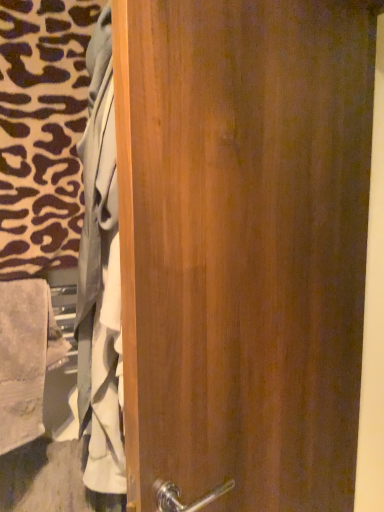
What is the approximate width of wooden door at center?

It is 14.48 centimeters.

This screenshot has width=384, height=512. Describe the element at coordinates (244, 245) in the screenshot. I see `wooden door at center` at that location.

Measure the distance between wooden door at center and camera.

A distance of 24.18 inches exists between wooden door at center and camera.

Find the location of a particular element. This screenshot has height=512, width=384. wooden door at center is located at coordinates 244,245.

What is the approximate height of wooden door at center?

wooden door at center is 1.42 meters in height.

You are a GUI agent. You are given a task and a screenshot of the screen. Output one action in this format:
    pyautogui.click(x=<x>, y=<y>)
    Task: Click on the wooden door at center
    Image resolution: width=384 pixels, height=512 pixels.
    Given the screenshot: What is the action you would take?
    244,245